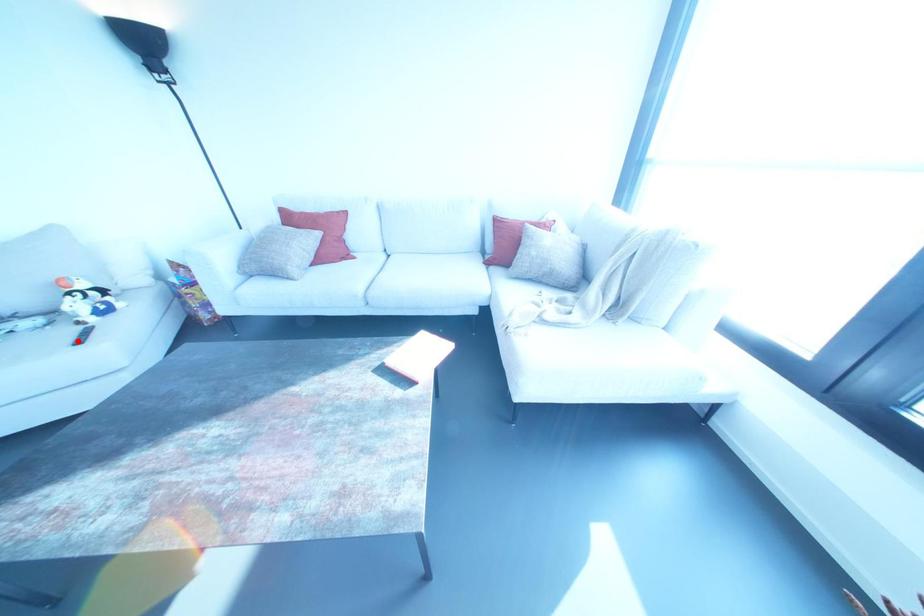
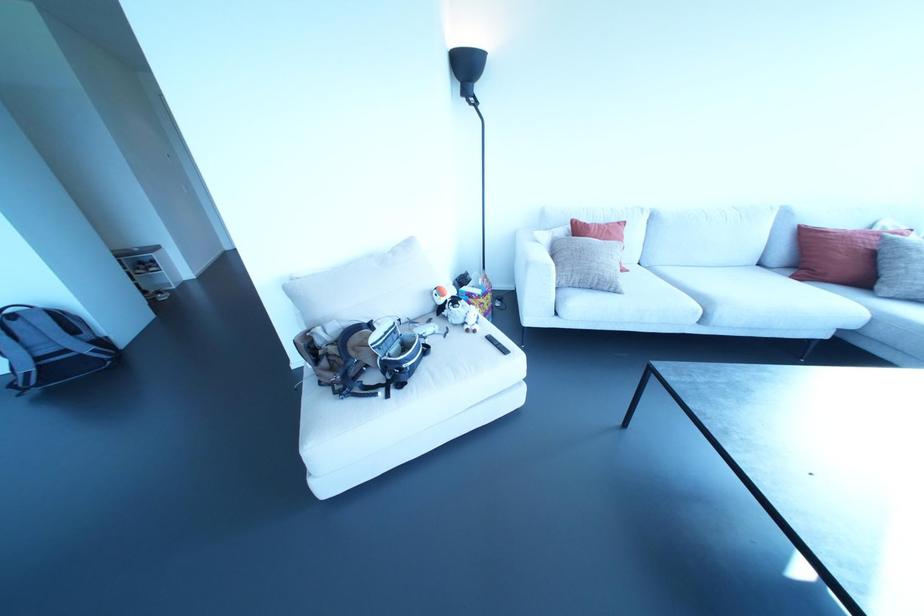
Question: I am providing you with two images of the same scene from different viewpoints. A red point is marked on the first image. At the location where the point appears in image 1, is it still visible in image 2?

Choices:
 (A) Yes
 (B) No

Answer: (A)